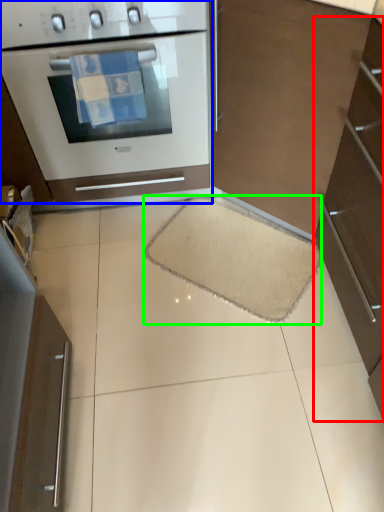
Question: Considering the real-world distances, which object is farthest from cabinetry (highlighted by a red box)? home appliance (highlighted by a blue box) or doormat (highlighted by a green box)?

Choices:
 (A) home appliance
 (B) doormat

Answer: (A)